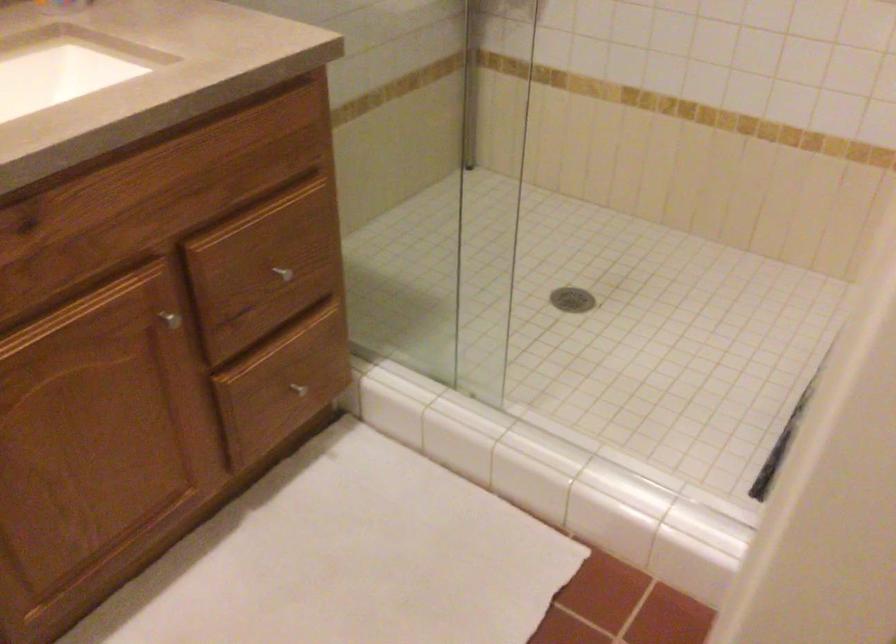
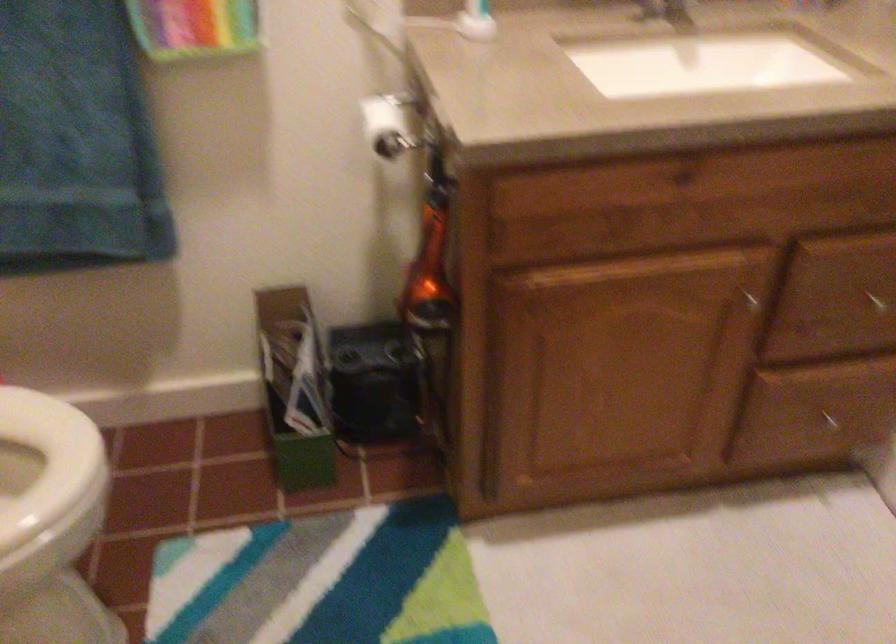
In the second image, find the point that corresponds to the point at 298,386 in the first image.

(831, 422)